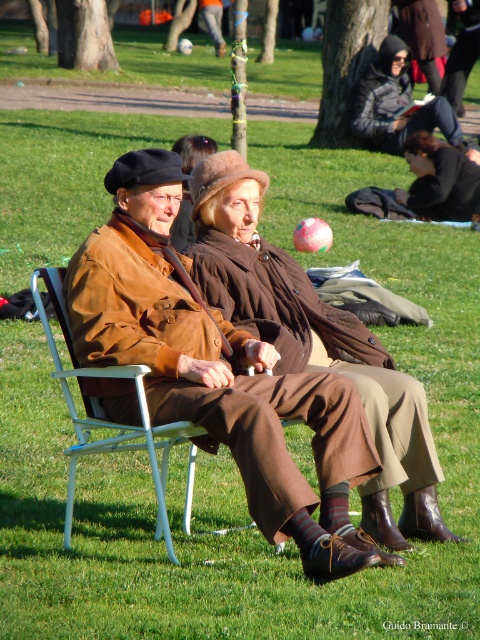
Question: Is dark gray hooded jacket at center smaller than brown woolen coat at center?

Choices:
 (A) yes
 (B) no

Answer: (B)

Question: Is brown suede jacket at center smaller than dark gray hooded jacket at center?

Choices:
 (A) yes
 (B) no

Answer: (A)

Question: Among these points, which one is farthest from the camera?

Choices:
 (A) (183, 241)
 (B) (435, 202)
 (C) (427, 100)

Answer: (C)

Question: Among these points, which one is nearest to the camera?

Choices:
 (A) (381, 44)
 (B) (184, 225)
 (C) (430, 154)

Answer: (B)

Question: Does brown suede jacket at center lie behind brown woolen coat at center?

Choices:
 (A) yes
 (B) no

Answer: (B)

Question: Which point is closer to the camera?

Choices:
 (A) (479, 156)
 (B) (419, 140)

Answer: (B)